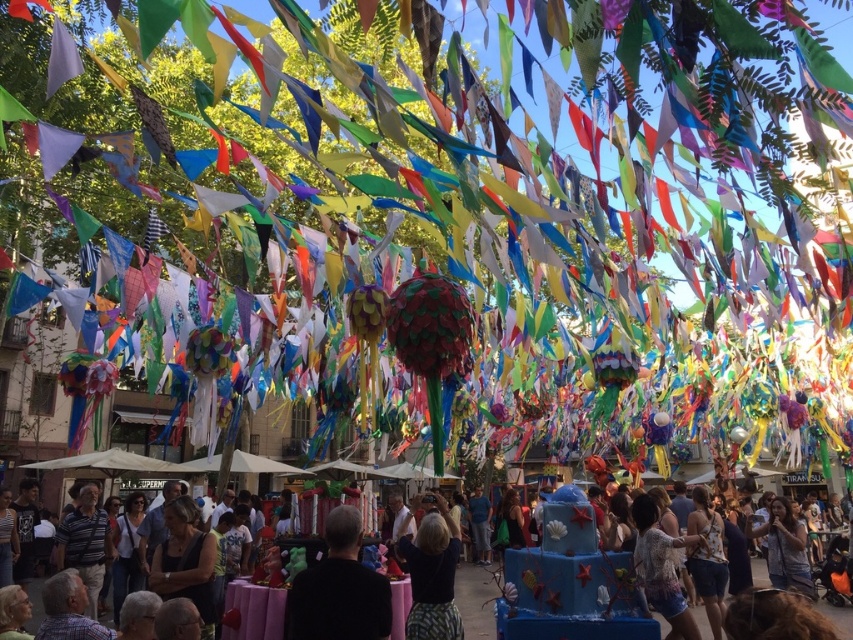
Based on the photo, you are a festival attendee holding a 10 cm wide ribbon that you want to hang between the dark blue fabric at center and the matte black shirt at center. Based on their widths, can you determine which object you should attach the ribbon to so it fits without overlapping?

The dark blue fabric at center is narrower than the matte black shirt at center, so attaching the ribbon to the dark blue fabric at center would ensure it fits without overlapping.

You are a photographer at the festival and want to take a clear photo of the black matte shirt at center. However, there is another matte black shirt at center in the scene. Which one is closer to you?

The black matte shirt at center is closer to you because it is in front of the matte black shirt at center.

Looking at this image, you are a photographer standing in the festival area and want to take a photo of both the dark blue fabric at center and the matte black shirt at center. Which object will appear larger in the photo?

The dark blue fabric at center will appear larger in the photo because it is closer to the viewer than the matte black shirt at center.